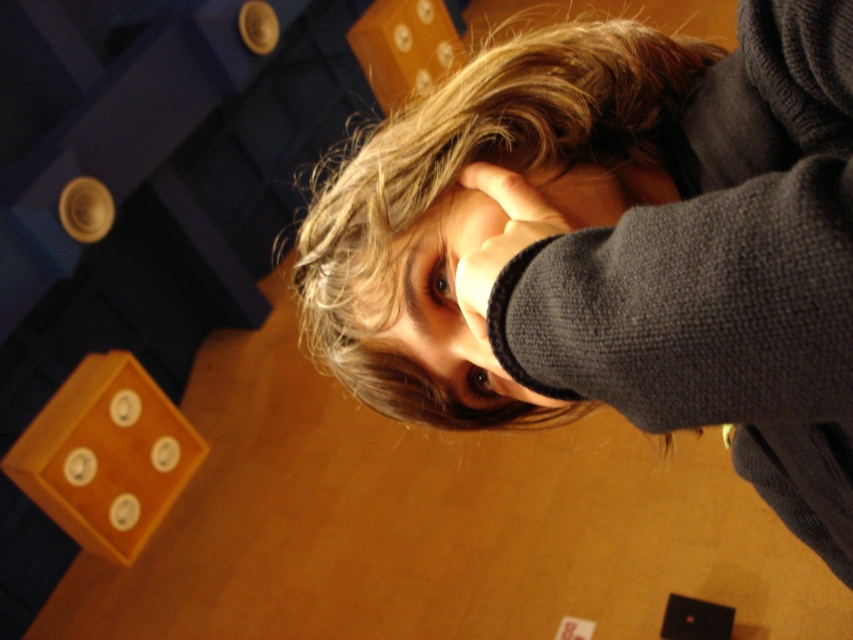
The width and height of the screenshot is (853, 640). In order to click on blonde textured hair at center in this screenshot , I will do `click(477, 208)`.

Looking at this image, measure the distance between blonde textured hair at center and smooth skin face at center.

A distance of 4.90 centimeters exists between blonde textured hair at center and smooth skin face at center.

What do you see at coordinates (477, 208) in the screenshot? I see `blonde textured hair at center` at bounding box center [477, 208].

This screenshot has width=853, height=640. What are the coordinates of `blonde textured hair at center` in the screenshot? It's located at (477, 208).

Is blonde textured hair at center wider than dark gray knitted hand at center?

Indeed, blonde textured hair at center has a greater width compared to dark gray knitted hand at center.

You are a GUI agent. You are given a task and a screenshot of the screen. Output one action in this format:
    pyautogui.click(x=<x>, y=<y>)
    Task: Click on the blonde textured hair at center
    The height and width of the screenshot is (640, 853).
    Given the screenshot: What is the action you would take?
    pyautogui.click(x=477, y=208)

Between point (442, 224) and point (498, 180), which one is positioned behind?

Point (442, 224)

The width and height of the screenshot is (853, 640). I want to click on smooth skin face at center, so click(x=454, y=292).